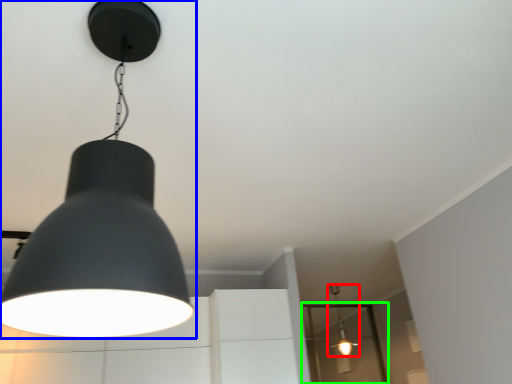
Question: Estimate the real-world distances between objects in this image. Which object is closer to lamp (highlighted by a red box), lamp (highlighted by a blue box) or glass door (highlighted by a green box)?

Choices:
 (A) lamp
 (B) glass door

Answer: (B)